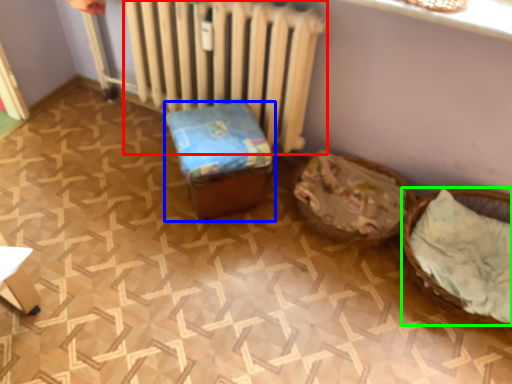
Question: Which object is the farthest from radiator (highlighted by a red box)? Choose among these: furniture (highlighted by a blue box) or basket (highlighted by a green box).

Choices:
 (A) furniture
 (B) basket

Answer: (B)